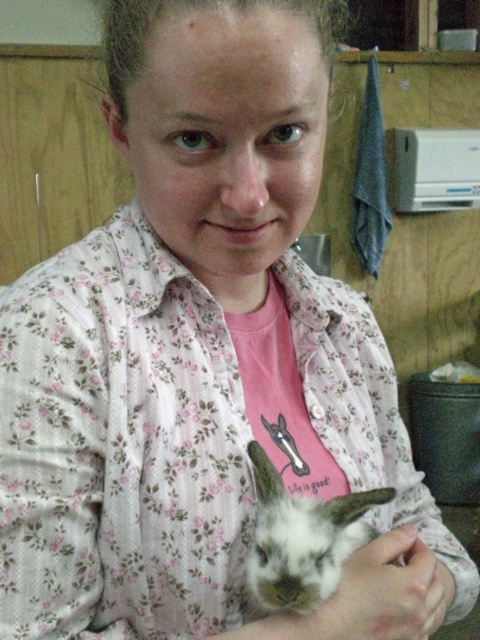
Question: Which point appears closest to the camera in this image?

Choices:
 (A) (357, 632)
 (B) (364, 525)

Answer: (A)

Question: Is white fur rabbit at center above white matte hand at lower center?

Choices:
 (A) no
 (B) yes

Answer: (B)

Question: Can you confirm if white fur rabbit at center is positioned to the left of white matte hand at lower center?

Choices:
 (A) yes
 (B) no

Answer: (A)

Question: Considering the relative positions of white fur rabbit at center and white matte hand at lower center in the image provided, where is white fur rabbit at center located with respect to white matte hand at lower center?

Choices:
 (A) right
 (B) left

Answer: (B)

Question: Which object is closer to the camera taking this photo?

Choices:
 (A) white fur rabbit at center
 (B) white matte hand at lower center

Answer: (A)